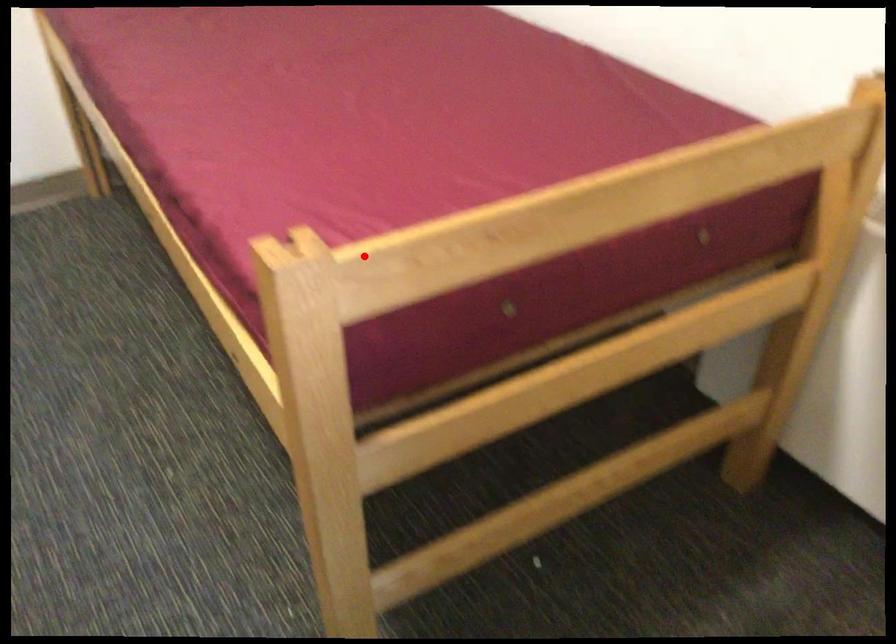
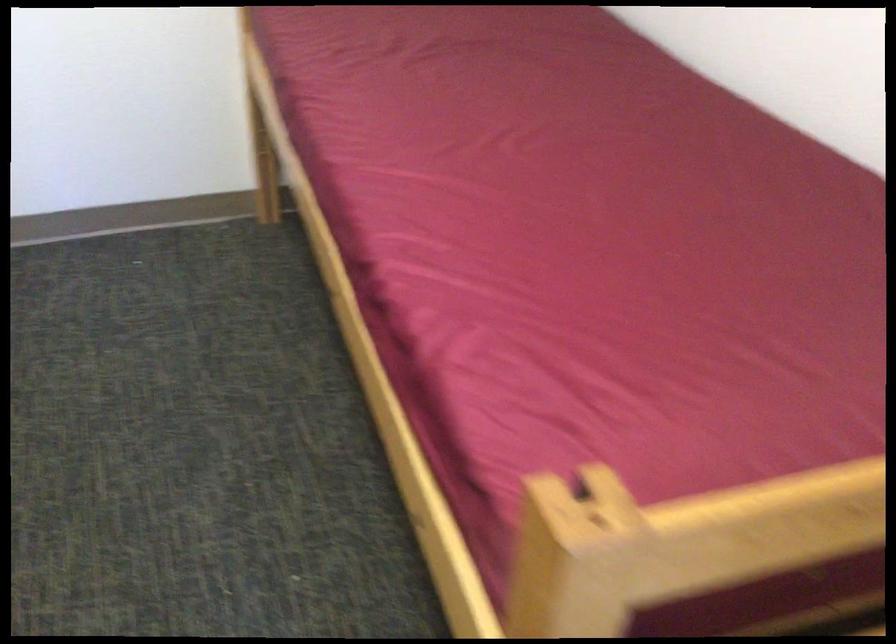
Question: I am providing you with two images of the same scene from different viewpoints. Given a red point in image1, look at the same physical point in image2. Is it:

Choices:
 (A) Closer to the viewpoint
 (B) Farther from the viewpoint

Answer: (A)